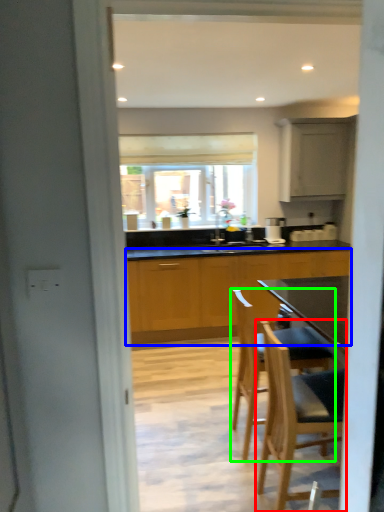
Question: Which object is the farthest from chair (highlighted by a red box)? Choose among these: cabinetry (highlighted by a blue box) or chair (highlighted by a green box).

Choices:
 (A) cabinetry
 (B) chair

Answer: (A)